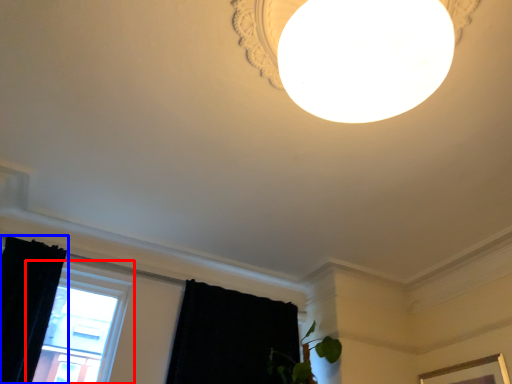
Question: Which object appears closest to the camera in this image, window (highlighted by a red box) or curtain (highlighted by a blue box)?

Choices:
 (A) window
 (B) curtain

Answer: (B)